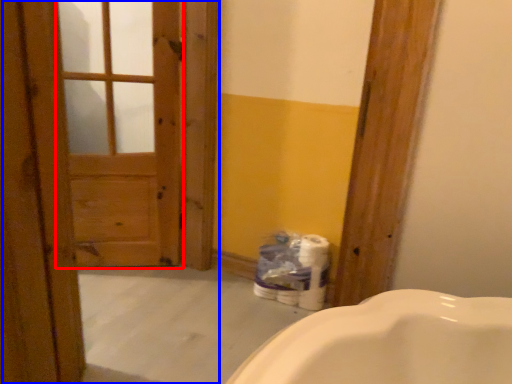
Question: Which of the following is the closest to the observer, screen door (highlighted by a red box) or barn door (highlighted by a blue box)?

Choices:
 (A) screen door
 (B) barn door

Answer: (B)